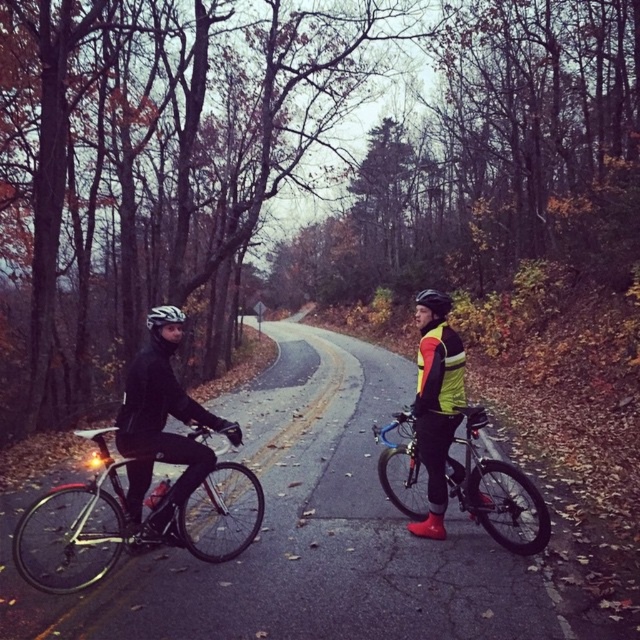
You are planning to park your bicycle on this road. You notice the shiny black bicycle at left and the shiny metallic bicycle at center. Which bicycle has a wider body to consider for parking space?

The shiny black bicycle at left has a larger width than the shiny metallic bicycle at center, so it requires more space for parking.

You are standing at the center of the road in the image. Which direction should you walk to reach the shiny black bicycle at left?

The shiny black bicycle at left is located at point (x=77, y=525), which is to the left side of the road. Therefore, you should walk to the left to reach it.

You are a pedestrian standing at the edge of the road. You see the matte black bicycle at left and the black matte helmet at center. If you want to cross the road safely, which object should you wait for to pass first?

You should wait for the matte black bicycle at left to pass first because it is closer to you than the black matte helmet at center, which is 13.84 feet away.